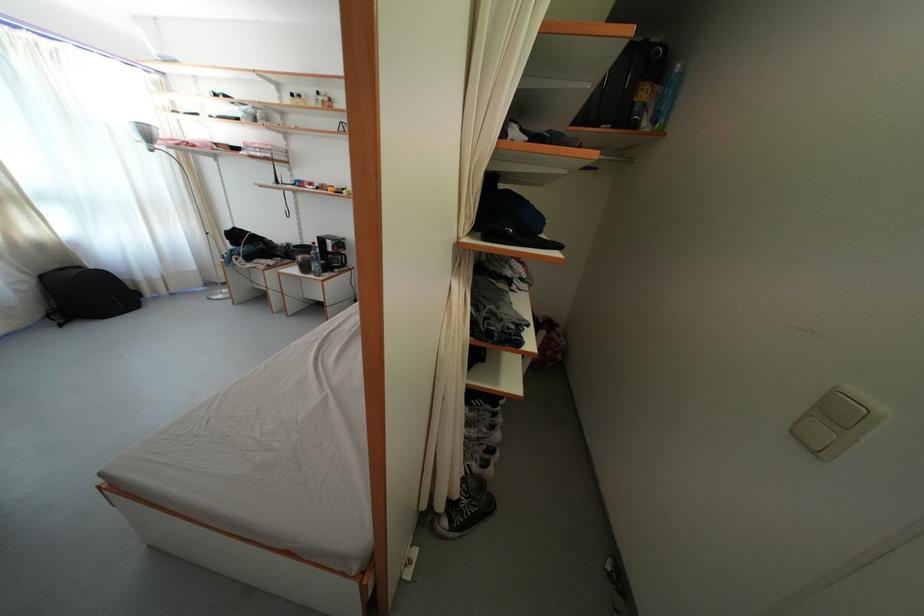
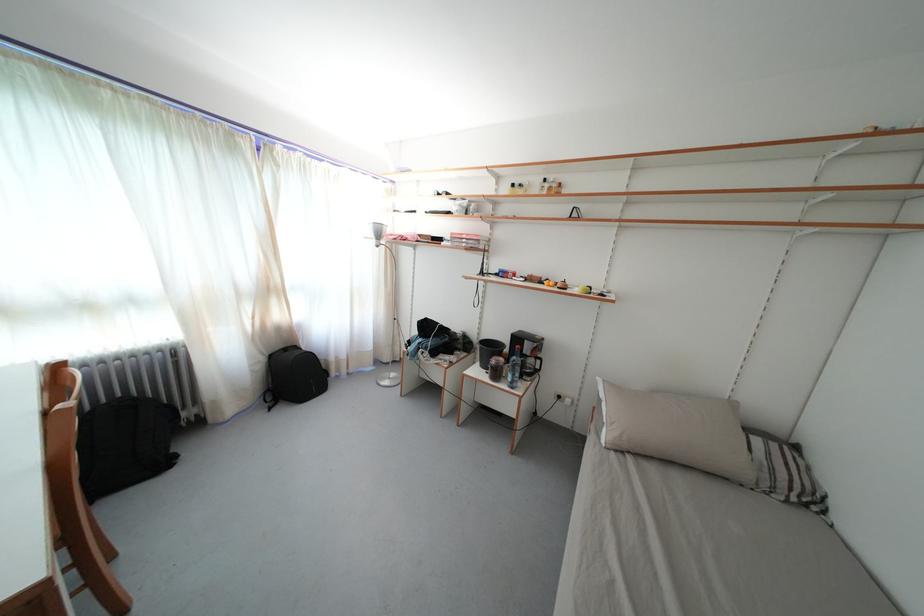
In the second image, find the point that corresponds to point 311,249 in the first image.

(491, 341)